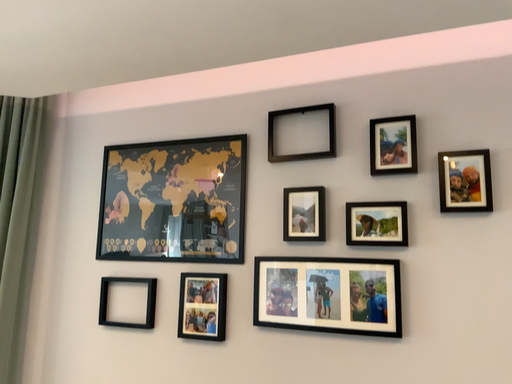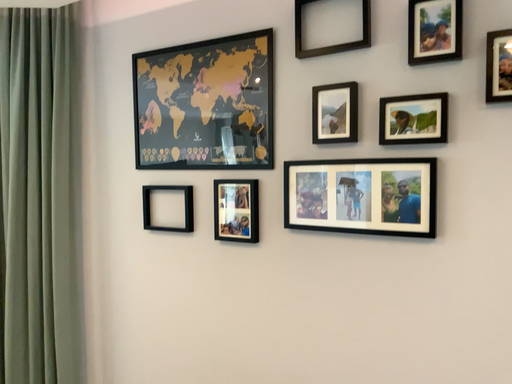
Question: Which way did the camera rotate in the video?

Choices:
 (A) rotated left
 (B) rotated right

Answer: (A)